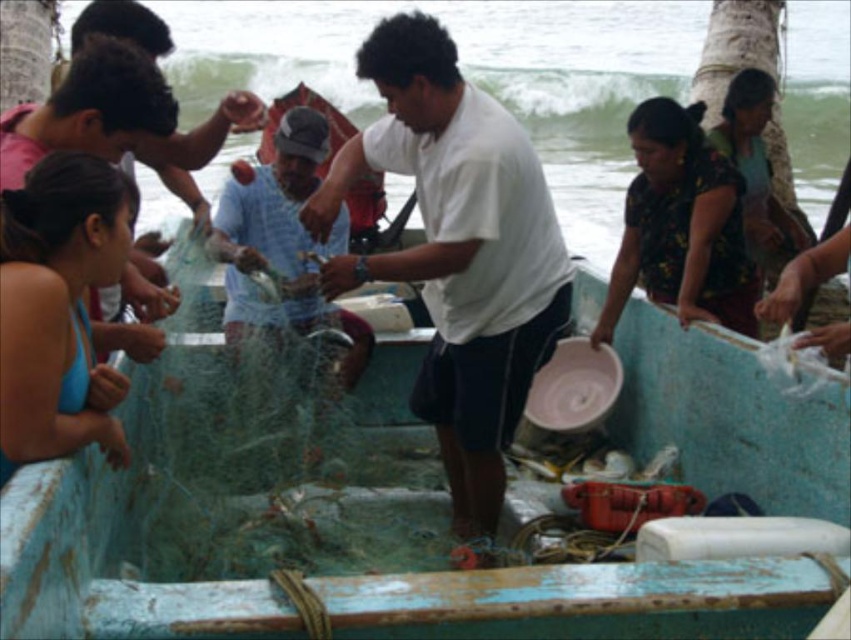
Is blue painted wood boat at center to the right of translucent plastic net at center from the viewer's perspective?

Indeed, blue painted wood boat at center is positioned on the right side of translucent plastic net at center.

What do you see at coordinates (323, 528) in the screenshot? Image resolution: width=851 pixels, height=640 pixels. I see `blue painted wood boat at center` at bounding box center [323, 528].

Between point (94, 481) and point (273, 227), which one is positioned behind?

Positioned behind is point (273, 227).

Where is `blue painted wood boat at center`? The image size is (851, 640). blue painted wood boat at center is located at coordinates (323, 528).

Measure the distance between white matte shirt at center and camera.

A distance of 11.14 feet exists between white matte shirt at center and camera.

Does white matte shirt at center appear under translucent plastic net at center?

Yes, white matte shirt at center is below translucent plastic net at center.

Where is `white matte shirt at center`? white matte shirt at center is located at coordinates (457, 257).

Is blue painted wood boat at center smaller than white matte shirt at center?

Actually, blue painted wood boat at center might be larger than white matte shirt at center.

Who is positioned more to the right, blue painted wood boat at center or white matte shirt at center?

Positioned to the right is white matte shirt at center.

Between point (136, 364) and point (534, 356), which one is positioned in front?

Point (534, 356) is in front.

This screenshot has height=640, width=851. What are the coordinates of `blue painted wood boat at center` in the screenshot? It's located at (323, 528).